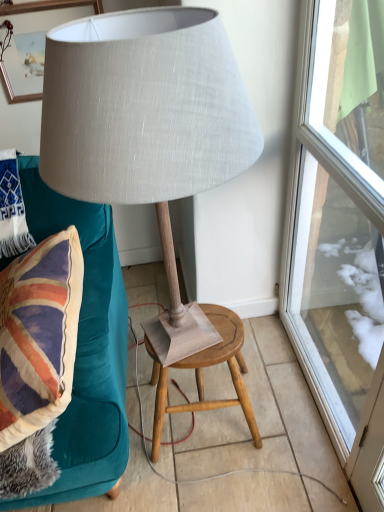
Where is `free point below wooden stool at center (from a real-world perspective)`? The image size is (384, 512). free point below wooden stool at center (from a real-world perspective) is located at coordinates coord(208,411).